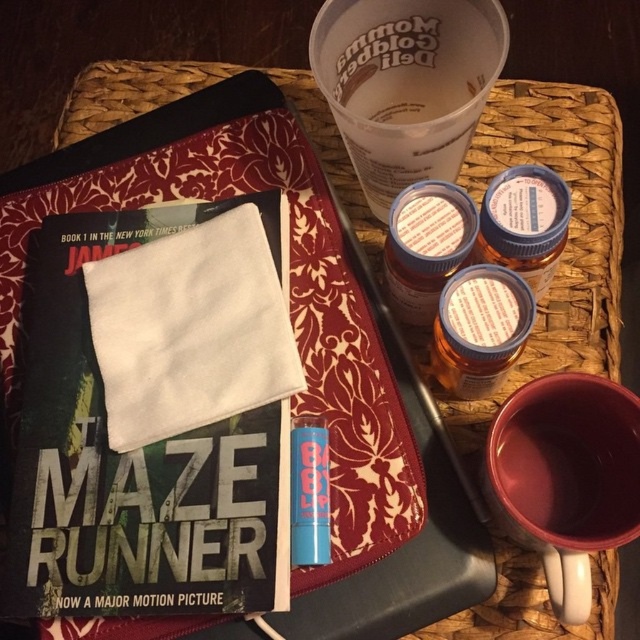
Question: Which of these objects is positioned farthest from the clear plastic cup at upper center?

Choices:
 (A) hardcover book at center
 (B) matte ceramic mug at lower right
 (C) reddish-brown fabric tray at upper center

Answer: (B)

Question: Which point is closer to the camera?

Choices:
 (A) clear plastic cup at upper center
 (B) reddish-brown fabric tray at upper center

Answer: (A)

Question: Is reddish-brown fabric tray at upper center positioned behind clear plastic cup at upper center?

Choices:
 (A) no
 (B) yes

Answer: (B)

Question: Does reddish-brown fabric tray at upper center have a larger size compared to matte ceramic mug at lower right?

Choices:
 (A) yes
 (B) no

Answer: (A)

Question: Is reddish-brown fabric tray at upper center wider than hardcover book at center?

Choices:
 (A) no
 (B) yes

Answer: (B)

Question: Which point is closer to the camera?

Choices:
 (A) (444, 32)
 (B) (609, 504)
 (C) (356, 592)
 (D) (182, 445)

Answer: (C)